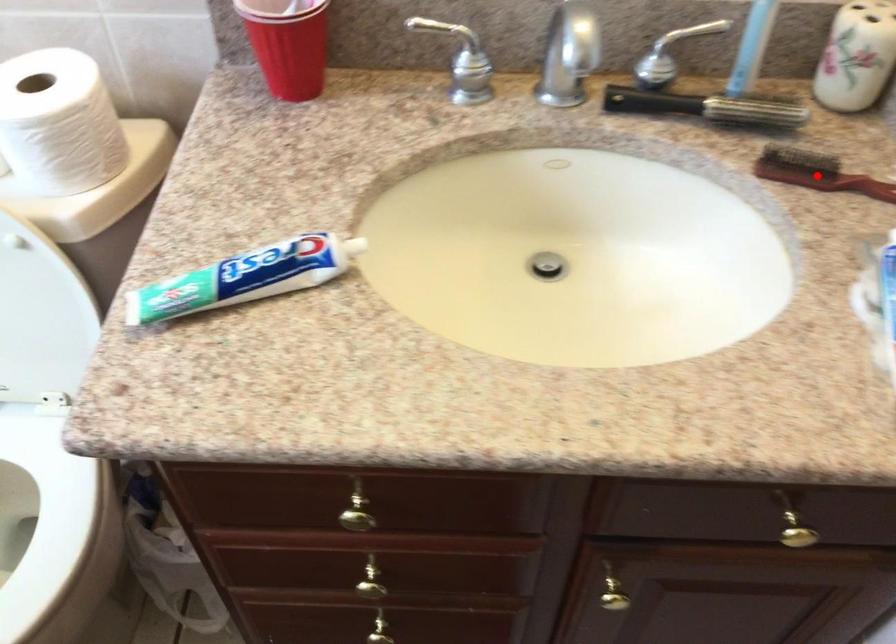
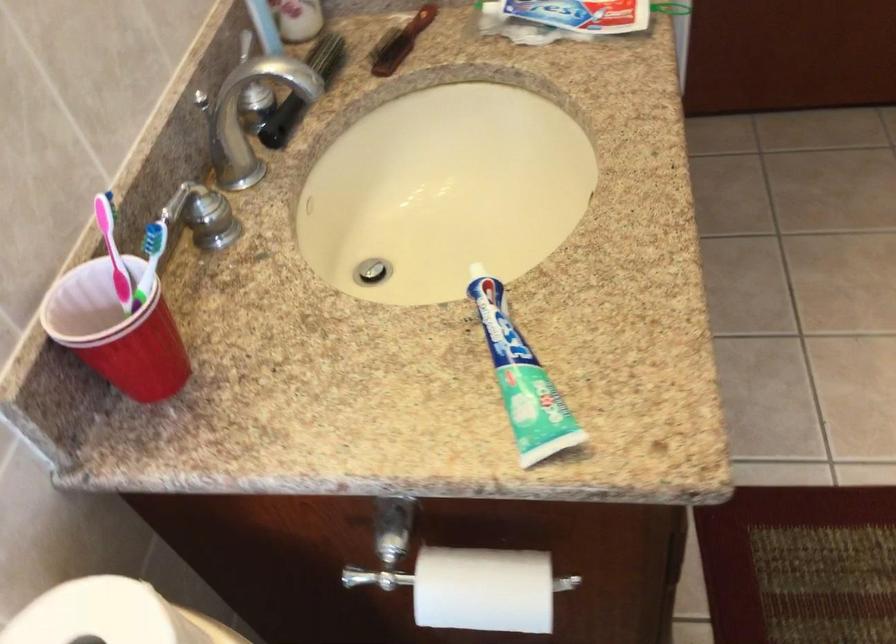
Question: I am providing you with two images of the same scene from different viewpoints. Given a red point in image1, look at the same physical point in image2. Is it:

Choices:
 (A) Closer to the viewpoint
 (B) Farther from the viewpoint

Answer: (B)